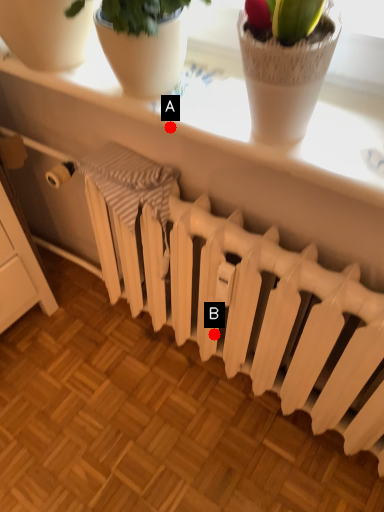
Question: Two points are circled on the image, labeled by A and B beside each circle. Which point appears closest to the camera in this image?

Choices:
 (A) A is closer
 (B) B is closer

Answer: (A)